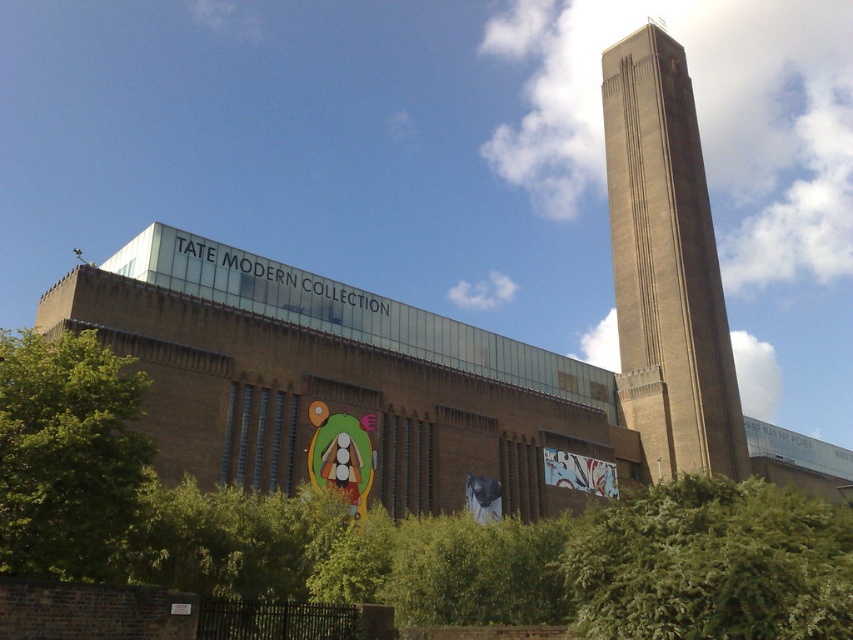
Is brown brick tower at upper right to the left of green leafy bush at lower right from the viewer's perspective?

No, brown brick tower at upper right is not to the left of green leafy bush at lower right.

What do you see at coordinates (666, 266) in the screenshot? The width and height of the screenshot is (853, 640). I see `brown brick tower at upper right` at bounding box center [666, 266].

Find the location of a particular element. This screenshot has width=853, height=640. brown brick tower at upper right is located at coordinates (666, 266).

Can you confirm if green leafy bush at lower right is shorter than green leafy tree at lower left?

Indeed, green leafy bush at lower right has a lesser height compared to green leafy tree at lower left.

Who is more distant from viewer, (675, 628) or (26, 444)?

Positioned behind is point (26, 444).

Where is `green leafy bush at lower right`? The image size is (853, 640). green leafy bush at lower right is located at coordinates coord(712,564).

Where is `green leafy bush at lower right`? Image resolution: width=853 pixels, height=640 pixels. green leafy bush at lower right is located at coordinates pos(712,564).

Does brown brick tower at upper right have a greater height compared to green leafy tree at lower left?

Yes, brown brick tower at upper right is taller than green leafy tree at lower left.

Is brown brick tower at upper right bigger than green leafy tree at lower left?

Yes, brown brick tower at upper right is bigger than green leafy tree at lower left.

Who is more forward, (x=635, y=308) or (x=16, y=330)?

Point (x=635, y=308) is more forward.

Find the location of a particular element. This screenshot has width=853, height=640. brown brick tower at upper right is located at coordinates (666, 266).